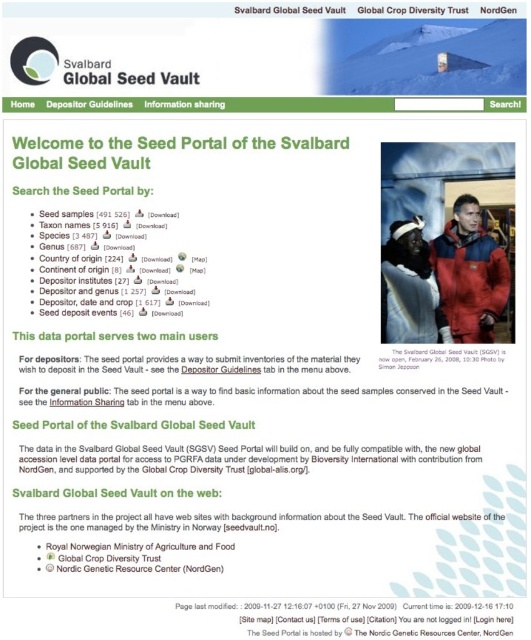
Question: Which object appears farthest from the camera in this image?

Choices:
 (A) white paper at upper center
 (B) matte plastic computer screen at upper right

Answer: (B)

Question: Which point appears farthest from the camera in this image?

Choices:
 (A) (448, 268)
 (B) (429, 253)
 (C) (447, 348)

Answer: (A)

Question: Does white paper at upper center appear on the left side of matte black sign at upper center?

Choices:
 (A) yes
 (B) no

Answer: (A)

Question: Which is nearer to the matte plastic computer screen at upper right?

Choices:
 (A) matte black sign at upper center
 (B) white paper at upper center
 (C) matte red jacket at center

Answer: (C)

Question: Is matte plastic computer screen at upper right above matte blue jacket at center?

Choices:
 (A) yes
 (B) no

Answer: (A)

Question: Is matte red jacket at center wider than matte black sign at upper center?

Choices:
 (A) no
 (B) yes

Answer: (A)